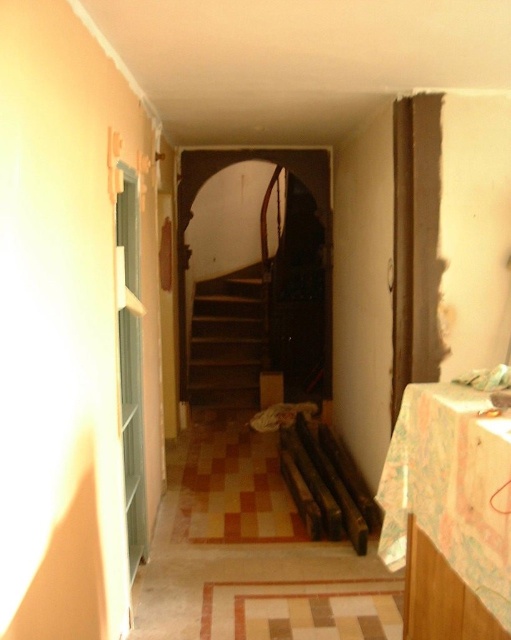
Does wooden stairs at center come in front of wooden at center?

No.

Between wooden stairs at center and wooden at center, which one appears on the left side from the viewer's perspective?

wooden stairs at center is more to the left.

Is point (266, 298) behind point (314, 433)?

Yes.

Locate an element on the screen. The height and width of the screenshot is (640, 511). wooden stairs at center is located at coordinates (228, 339).